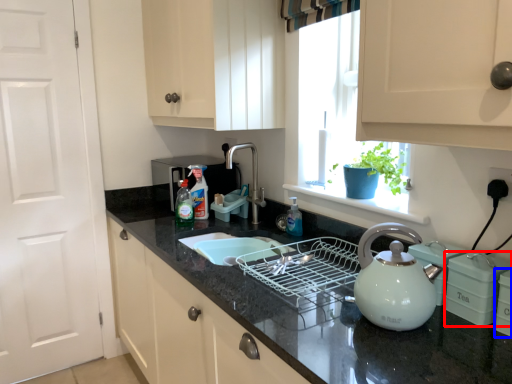
Question: Which of the following is the closest to the observer, appliance (highlighted by a red box) or appliance (highlighted by a blue box)?

Choices:
 (A) appliance
 (B) appliance

Answer: (B)